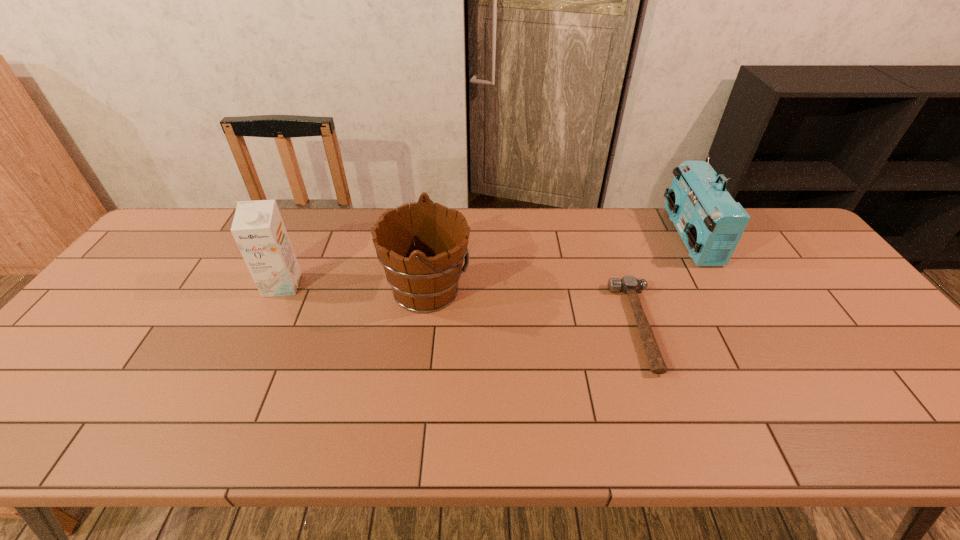
The width and height of the screenshot is (960, 540). I want to click on free space located on the striking face of the shortest object, so click(487, 326).

In order to click on blank space located 0.270m on the striking face of the shortest object in this screenshot , I will do `click(514, 326)`.

This screenshot has height=540, width=960. Find the location of `free region located 0.260m on the striking face of the shortest object`. free region located 0.260m on the striking face of the shortest object is located at coordinates (517, 326).

Locate an element on the screen. The height and width of the screenshot is (540, 960). object that is at the far edge is located at coordinates (710, 222).

Identify the location of vacant point at the far edge. (516, 210).

This screenshot has height=540, width=960. I want to click on free location at the near edge of the desktop, so click(x=363, y=439).

In the image, there is a desktop. At what (x,y) coordinates should I click in order to perform the action: click on vacant space at the left edge. Please return your answer as a coordinate pair (x, y). This screenshot has height=540, width=960. Looking at the image, I should click on (90, 338).

Find the location of a particular element. This screenshot has height=540, width=960. vacant space at the right edge of the desktop is located at coordinates (784, 272).

This screenshot has height=540, width=960. What are the coordinates of `vacant space at the far right corner of the desktop` in the screenshot? It's located at (756, 211).

What are the coordinates of `vacant region between the wine bucket and the carton` in the screenshot? It's located at (355, 288).